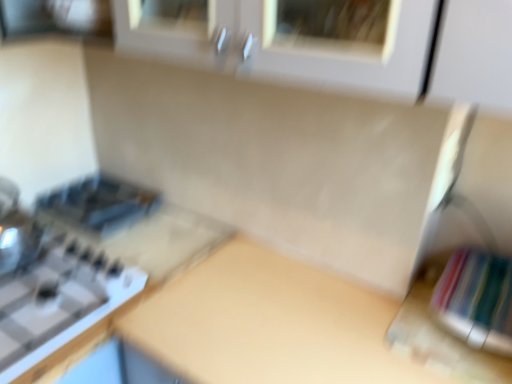
Locate an element on the screen. vacant point above beige matte counter top at center (from a real-world perspective) is located at coordinates (316, 311).